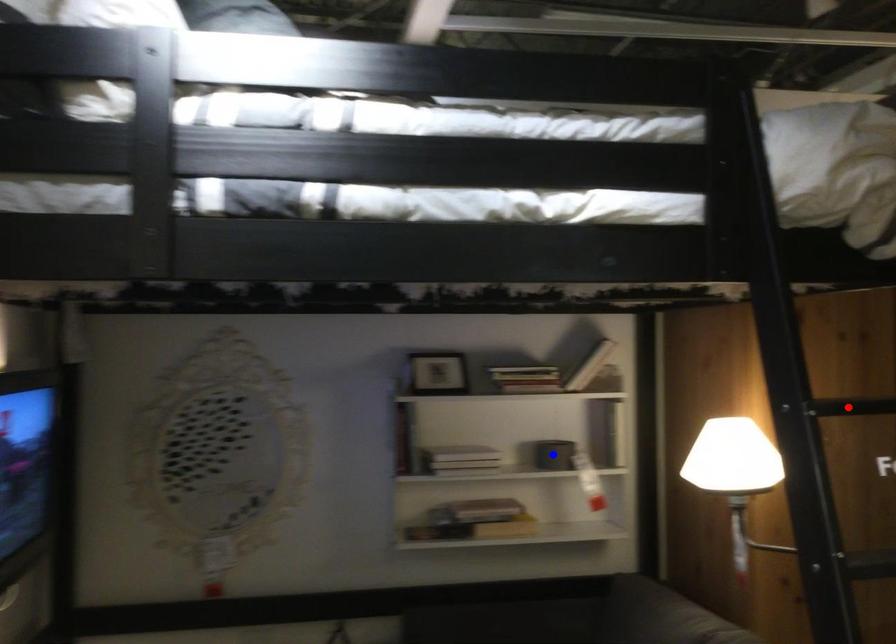
Question: Two points are marked on the image. Which point is closer to the camera?

Choices:
 (A) Blue point is closer.
 (B) Red point is closer.

Answer: (B)